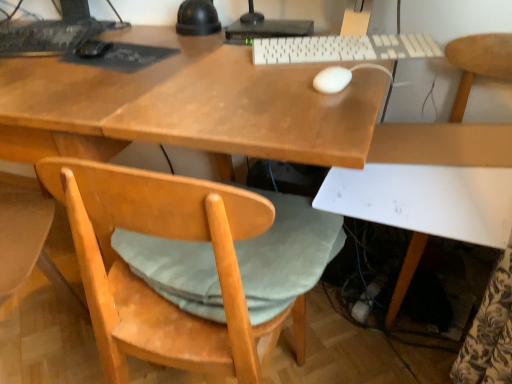
This screenshot has width=512, height=384. I want to click on free space to the left of white matte mouse at center, the 1th mouse positioned from the bottom, so click(x=247, y=84).